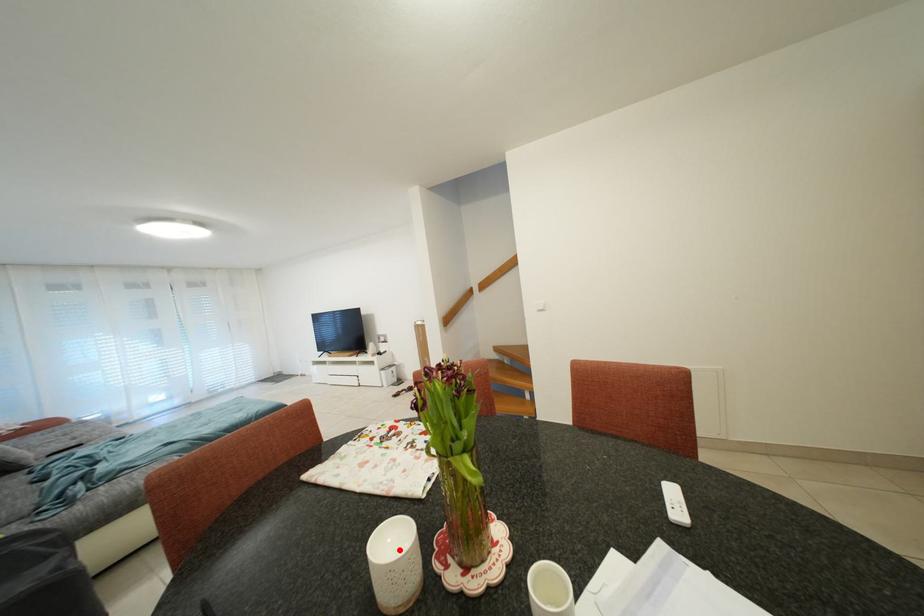
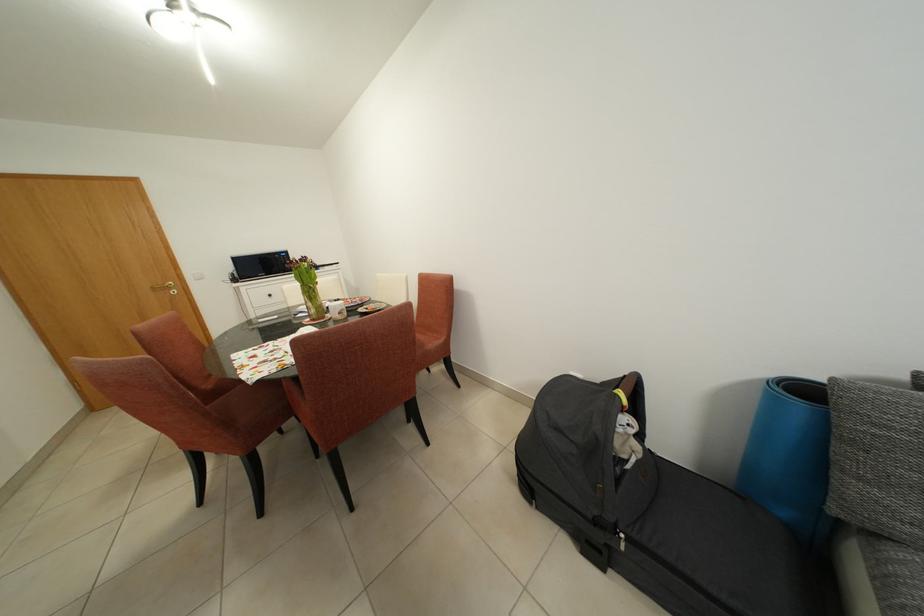
Where in the second image is the point corresponding to the highlighted location from the first image?

(345, 307)